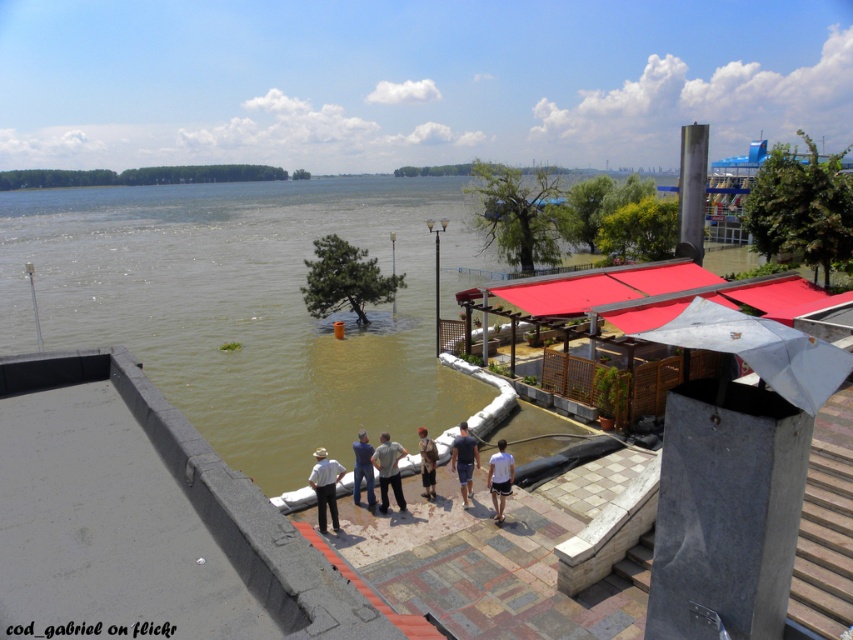
Which of these two, light gray fabric shirt at center or dark blue t-shirt at center, stands taller?

With more height is dark blue t-shirt at center.

Who is higher up, light gray fabric shirt at center or dark blue t-shirt at center?

light gray fabric shirt at center is above.

This screenshot has height=640, width=853. What are the coordinates of `light gray fabric shirt at center` in the screenshot? It's located at (387, 470).

Is the position of white cotton shirt at center more distant than that of light gray fabric shirt at center?

No, it is not.

The height and width of the screenshot is (640, 853). I want to click on white cotton shirt at center, so click(x=325, y=486).

Which is behind, point (329, 474) or point (430, 444)?

Point (430, 444)

Which of these two, white cotton shirt at center or light brown leather pants at center, stands shorter?

light brown leather pants at center

Who is more distant from viewer, (308, 483) or (422, 444)?

The point (308, 483) is more distant.

The width and height of the screenshot is (853, 640). I want to click on white cotton shirt at center, so pos(325,486).